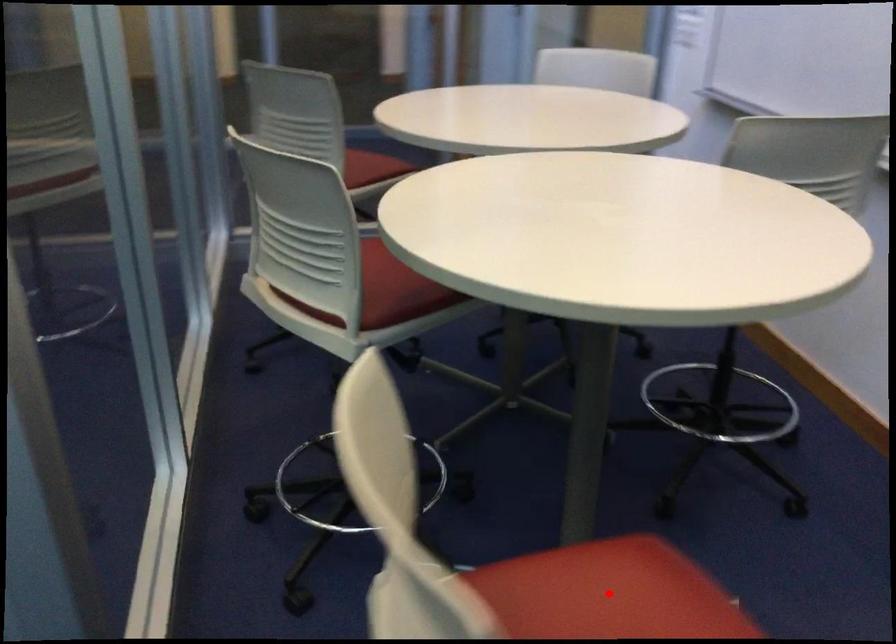
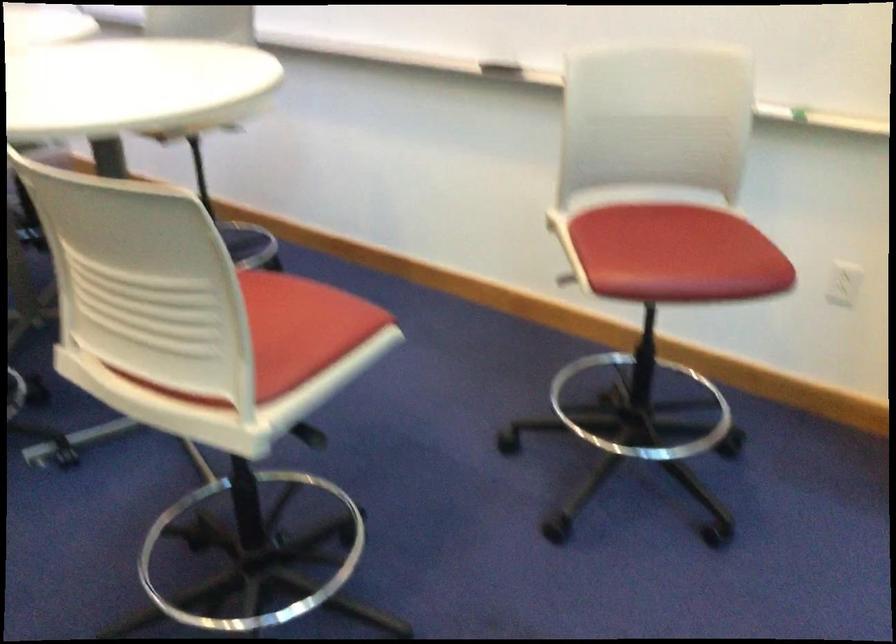
Question: I am providing you with two images of the same scene from different viewpoints. A red point is marked on the first image. Is the red point's position out of view in image 2?

Choices:
 (A) Yes
 (B) No

Answer: (A)